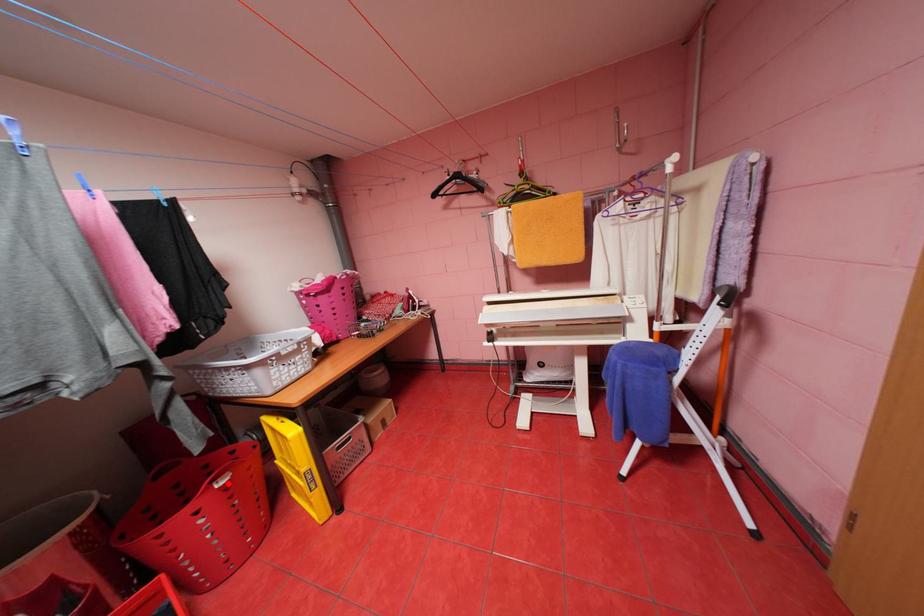
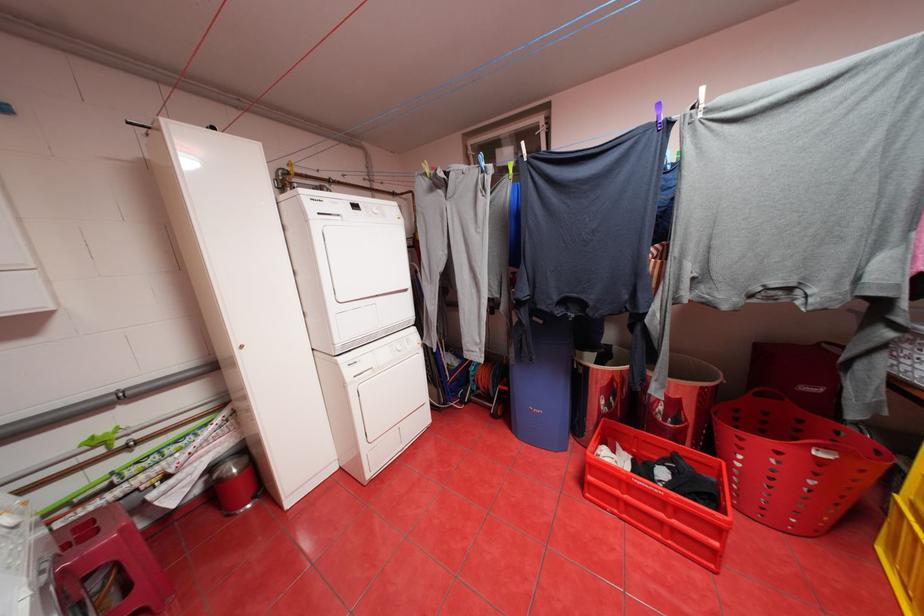
The point at the highlighted location is marked in the first image. Where is the corresponding point in the second image?

(828, 453)